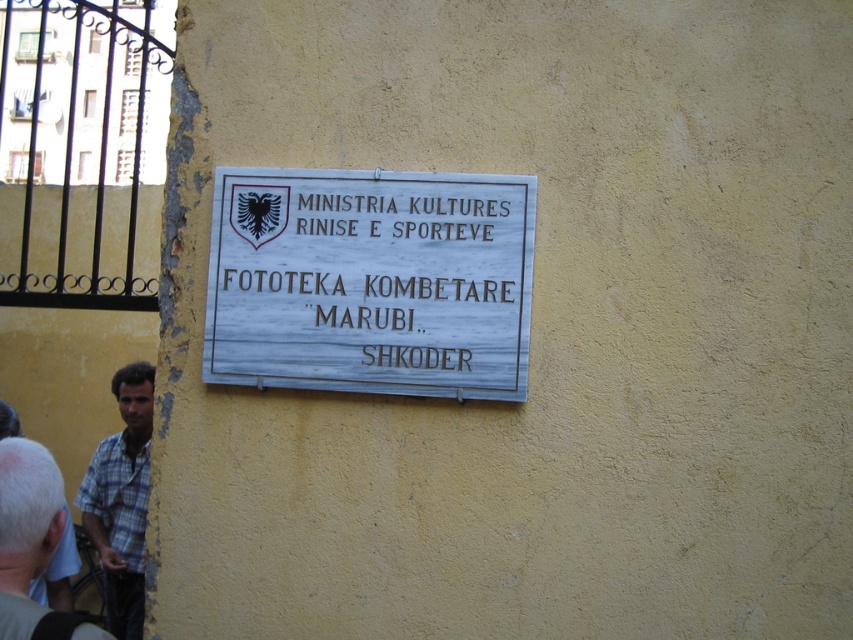
You are standing in front of the weathered yellow wall and see the white wooden sign at center and the plaid fabric shirt at lower left. Which object is taller?

The white wooden sign at center is much taller than the plaid fabric shirt at lower left.

You are standing in front of the weathered yellow wall and want to locate the white wooden sign at center. Where should you look relative to the wall?

The white wooden sign at center is located at point 0.435 on the vertical axis and 0.441 on the horizontal axis relative to the wall.

In the scene shown: You are standing in front of the weathered yellow wall and see the point at coordinates [370,282]. What object is located at those coordinates?

The point at coordinates [370,282] corresponds to the white wooden sign at center.